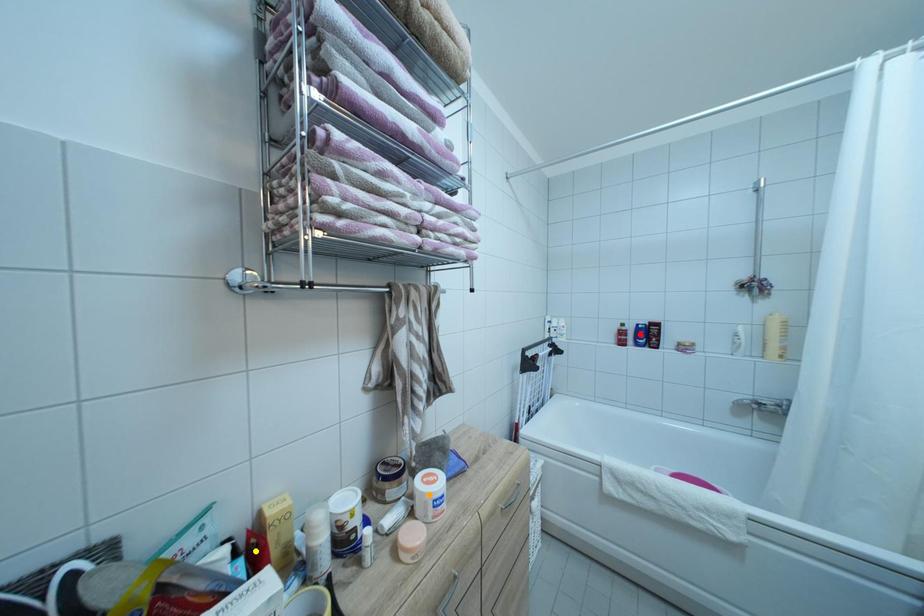
Order these from nearest to farthest:
red point, orange point, yellow point

red point, orange point, yellow point